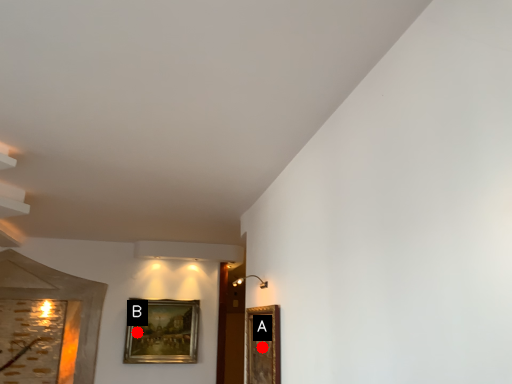
Question: Two points are circled on the image, labeled by A and B beside each circle. Which point is further to the camera?

Choices:
 (A) A is further
 (B) B is further

Answer: (B)